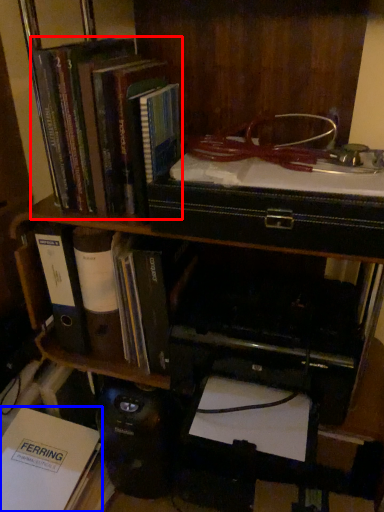
Question: Which of the following is the farthest to the observer, book (highlighted by a red box) or book (highlighted by a blue box)?

Choices:
 (A) book
 (B) book

Answer: (B)